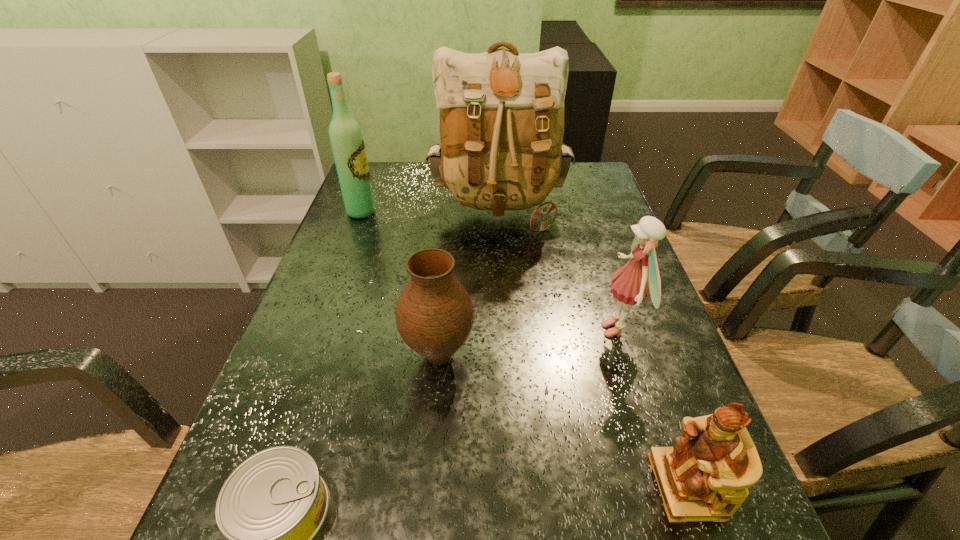
You are a GUI agent. You are given a task and a screenshot of the screen. Output one action in this format:
    pyautogui.click(x=<x>, y=<y>)
    Task: Click on the backpack
    This screenshot has height=540, width=960.
    Given the screenshot: What is the action you would take?
    pyautogui.click(x=501, y=113)

Find the location of a particular element. This screenshot has width=960, height=540. the fifth shortest object is located at coordinates (346, 139).

What are the coordinates of `doll` in the screenshot? It's located at (640, 276).

Where is `the third shortest object`? the third shortest object is located at coordinates (434, 315).

Where is `figurine`? The image size is (960, 540). figurine is located at coordinates (704, 477).

I want to click on free space located 0.170m on the front-facing side of the backpack, so click(x=503, y=288).

Where is `free space located on the front-facing side of the fifth shortest object`? The height and width of the screenshot is (540, 960). free space located on the front-facing side of the fifth shortest object is located at coordinates (508, 212).

Where is `free space located on the front-facing side of the doll`? This screenshot has height=540, width=960. free space located on the front-facing side of the doll is located at coordinates (517, 330).

Image resolution: width=960 pixels, height=540 pixels. I want to click on vacant space situated 0.340m on the front-facing side of the doll, so click(444, 330).

This screenshot has width=960, height=540. I want to click on vacant region located on the front-facing side of the doll, so click(458, 330).